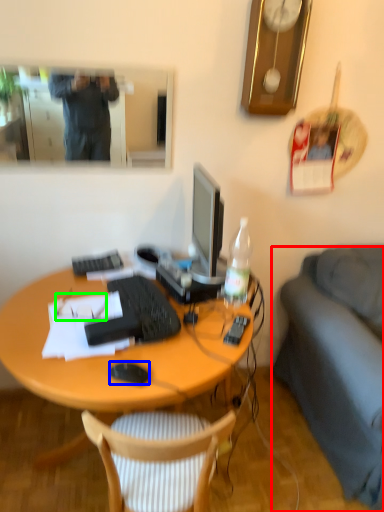
Question: Which object is the closest to the studio couch (highlighted by a red box)? Choose among these: computer mouse (highlighted by a blue box) or glasses (highlighted by a green box).

Choices:
 (A) computer mouse
 (B) glasses

Answer: (A)